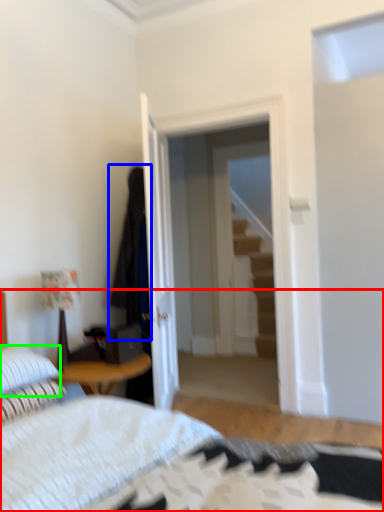
Question: Based on their relative distances, which object is nearer to bed (highlighted by a red box)? Choose from robe (highlighted by a blue box) and pillow (highlighted by a green box).

Choices:
 (A) robe
 (B) pillow

Answer: (B)